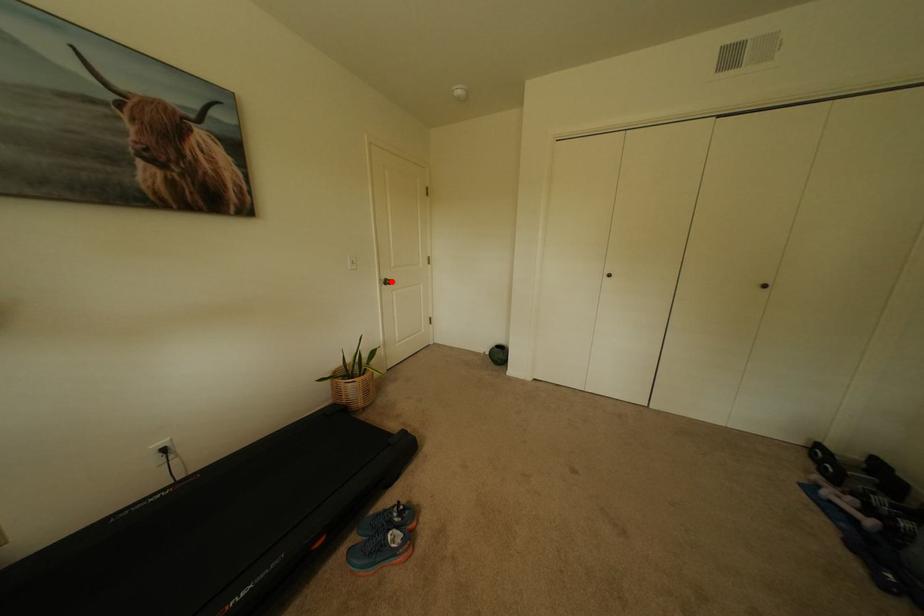
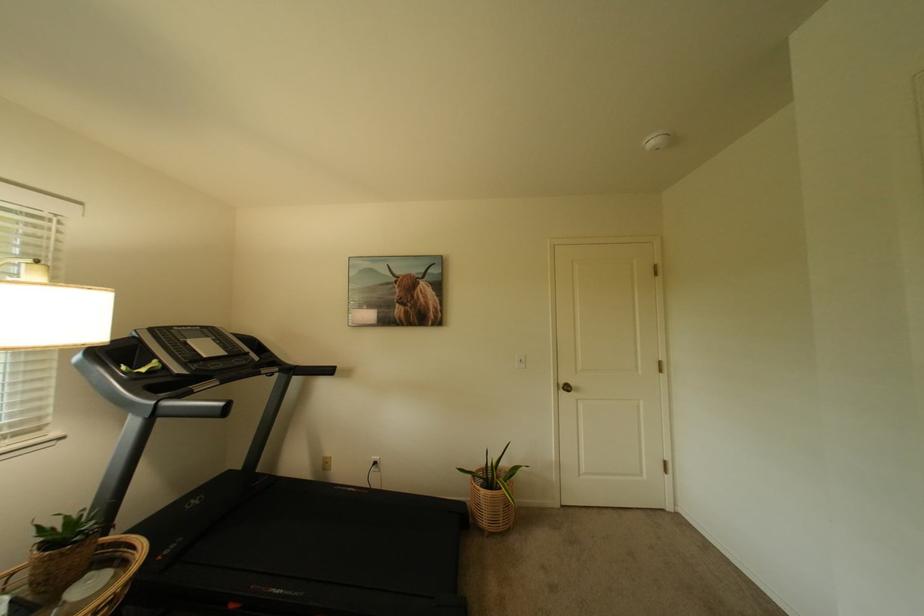
Question: I am providing you with two images of the same scene from different viewpoints. In image1, a red point is highlighted. Considering the same 3D point in image2, which of the following is correct?

Choices:
 (A) It is closer
 (B) It is farther

Answer: (B)